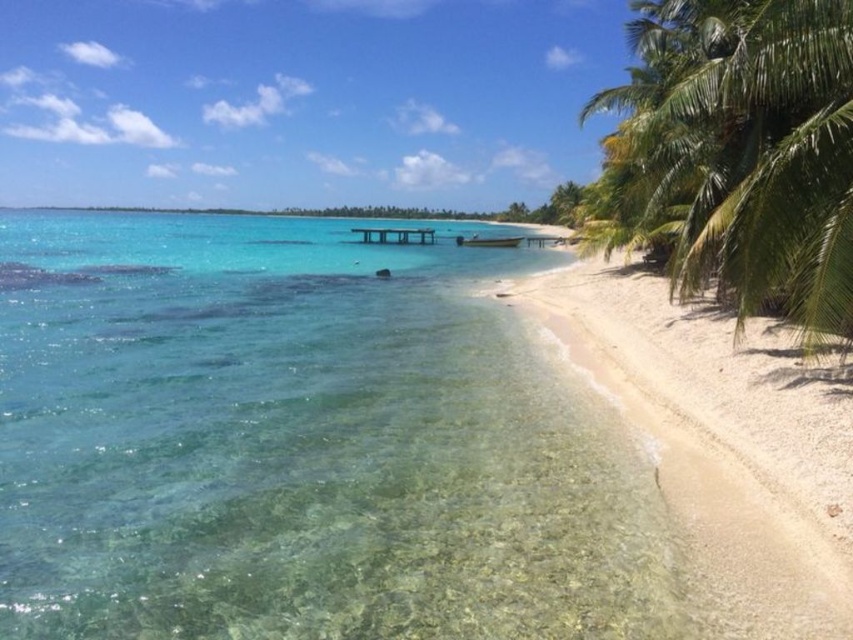
Question: Among these points, which one is nearest to the camera?

Choices:
 (A) (804, 282)
 (B) (183, 618)

Answer: (B)

Question: Among these points, which one is nearest to the camera?

Choices:
 (A) (4, 605)
 (B) (747, 211)

Answer: (A)

Question: Is clear glassy water at center thinner than green leafy palm tree at right?

Choices:
 (A) no
 (B) yes

Answer: (A)

Question: Is clear glassy water at center above green leafy palm tree at right?

Choices:
 (A) yes
 (B) no

Answer: (B)

Question: Is clear glassy water at center to the left of green leafy palm tree at right from the viewer's perspective?

Choices:
 (A) no
 (B) yes

Answer: (B)

Question: Among these points, which one is farthest from the camera?

Choices:
 (A) (9, 257)
 (B) (695, 152)

Answer: (A)